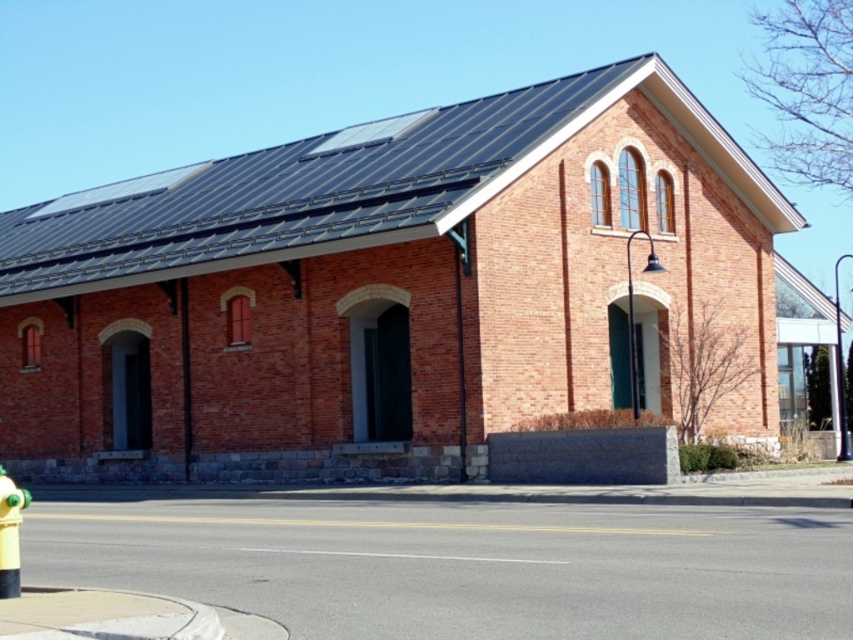
You are a pedestrian standing on the sidewalk in front of the brick building at center and the black metal pole at center. Which object is closer to your right side?

The black metal pole at center is closer to your right side because the brick building at center is to the left of it.

You are a city planner reviewing a map of the area. The coordinates of the yellow fire hydrant are at point A and the lamppost at point B. According to the map, where is the brick building at center located in relation to these points?

The brick building at center is located at point C, which is between points A and B.

You are a city planner assessing the building and pole for a new sidewalk design. The sidewalk must be wide enough to accommodate both the brick building at center and the black metal pole at center. Which object requires more space in the sidewalk design?

The black metal pole at center requires more space in the sidewalk design because it is wider than the brick building at center.